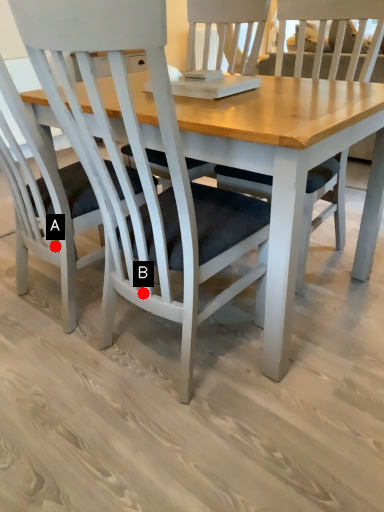
Question: Two points are circled on the image, labeled by A and B beside each circle. Which of the following is the farthest from the observer?

Choices:
 (A) A is further
 (B) B is further

Answer: (A)